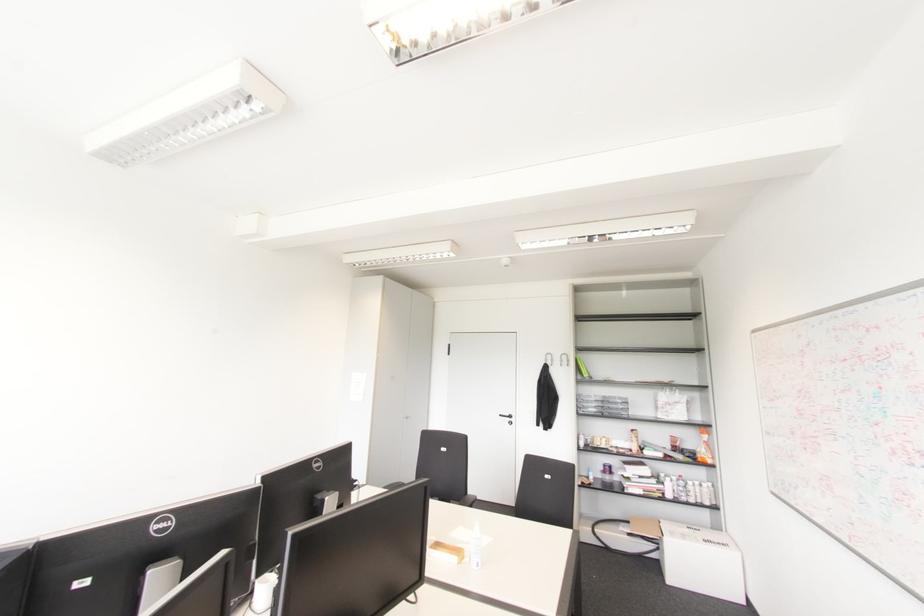
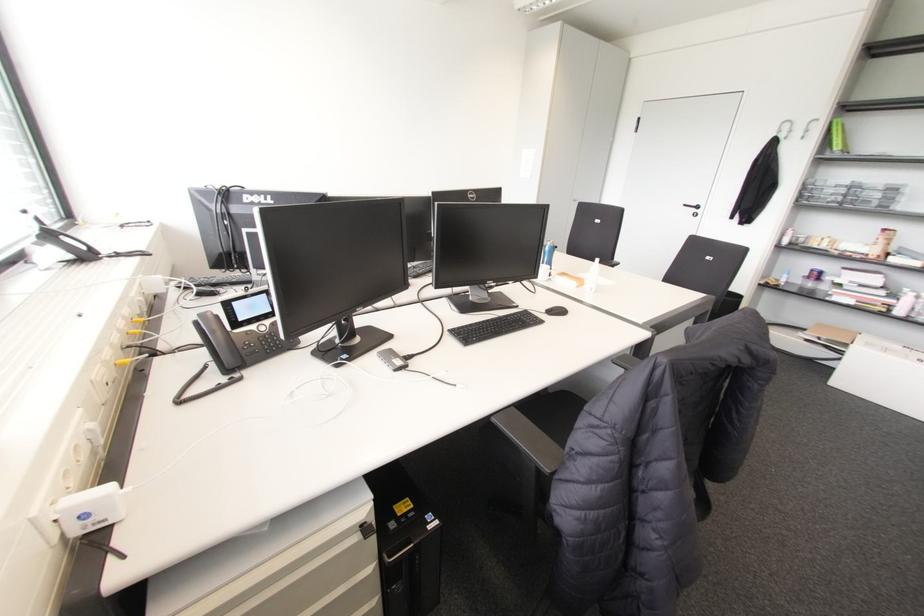
The point at (585, 374) is marked in the first image. Where is the corresponding point in the second image?

(836, 147)